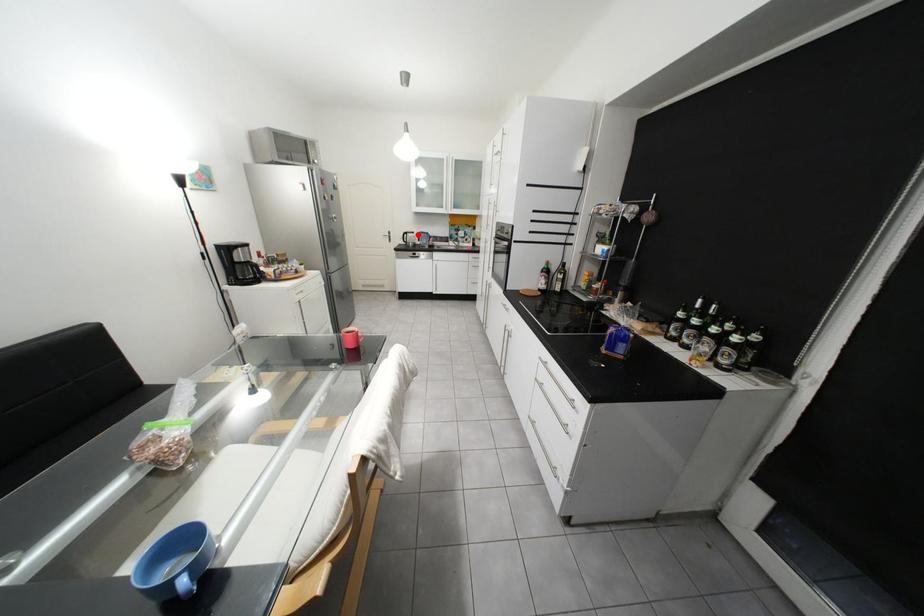
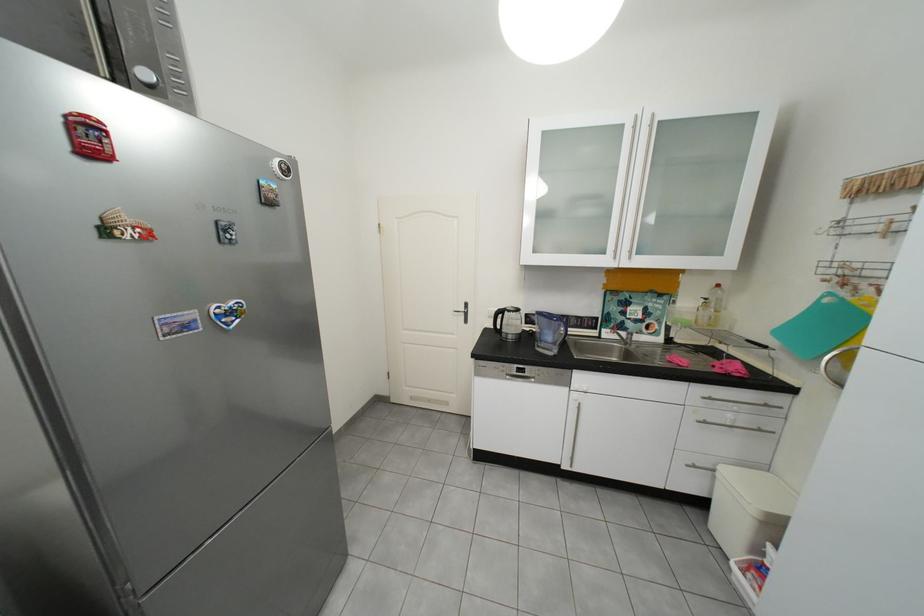
Find the pixel in the second image that matches the highlighted location in the first image.

(513, 313)